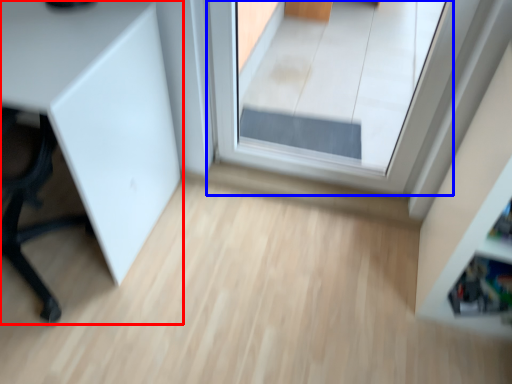
Question: Which object appears closest to the camera in this image, furniture (highlighted by a red box) or window (highlighted by a blue box)?

Choices:
 (A) furniture
 (B) window

Answer: (A)